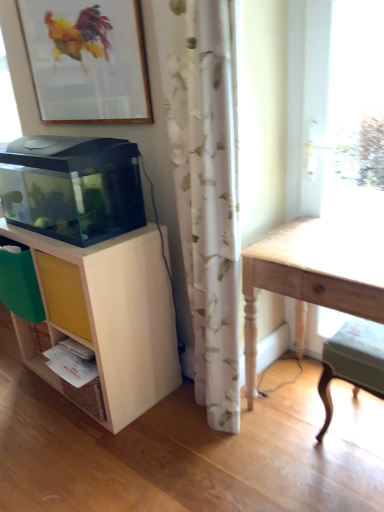
You are a GUI agent. You are given a task and a screenshot of the screen. Output one action in this format:
    pyautogui.click(x=<x>, y=<y>)
    Task: Click on the free space between matte wood shelf at left and white floral curtain at center
    This screenshot has height=512, width=384.
    Given the screenshot: What is the action you would take?
    pyautogui.click(x=176, y=425)